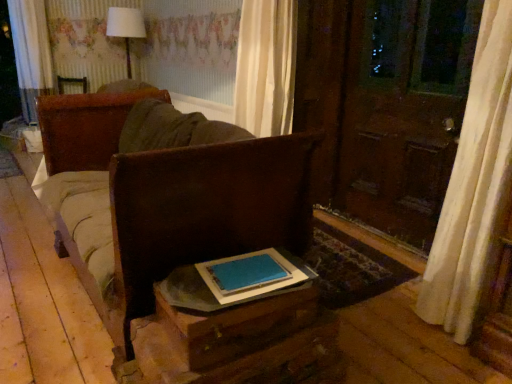
In order to face white fabric lampshade at upper center, should I rotate leftwards or rightwards?

Rotate your view left by about 16.897°.

This screenshot has width=512, height=384. I want to click on white fabric lampshade at upper center, so click(126, 28).

This screenshot has height=384, width=512. What are the coordinates of `wooden table at lower center` in the screenshot? It's located at (233, 315).

Considering the positions of points (264, 204) and (130, 56), is point (264, 204) farther from camera compared to point (130, 56)?

No, it is in front of (130, 56).

Considering the positions of objects brown leather couch at center and white fabric lampshade at upper center in the image provided, who is behind, brown leather couch at center or white fabric lampshade at upper center?

white fabric lampshade at upper center is behind.

From a real-world perspective, does blue matte book at center stand above brown leather couch at center?

Yes, from a real-world perspective, blue matte book at center is over brown leather couch at center

This screenshot has height=384, width=512. Identify the location of book that is on the right side of brown leather couch at center. (251, 275).

Is blue matte book at center thinner than brown leather couch at center?

Indeed, blue matte book at center has a lesser width compared to brown leather couch at center.

From the image's perspective, is white fabric lampshade at upper center located above or below blue matte book at center?

Clearly, from the image's perspective, white fabric lampshade at upper center is above blue matte book at center.

Are white fabric lampshade at upper center and blue matte book at center far apart?

white fabric lampshade at upper center is positioned a significant distance from blue matte book at center.

What's the angular difference between white fabric lampshade at upper center and blue matte book at center's facing directions?

48.7 degrees.

Is point (131, 31) farther from viewer compared to point (238, 301)?

Yes.

Between blue matte book at center and white fabric lampshade at upper center, which one appears on the right side from the viewer's perspective?

Positioned to the right is blue matte book at center.

Considering the sizes of blue matte book at center and white fabric lampshade at upper center in the image, is blue matte book at center bigger or smaller than white fabric lampshade at upper center?

In the image, blue matte book at center appears to be smaller than white fabric lampshade at upper center.

In terms of width, does blue matte book at center look wider or thinner when compared to white fabric lampshade at upper center?

In the image, blue matte book at center appears to be more narrow than white fabric lampshade at upper center.

Between blue matte book at center and white fabric lampshade at upper center, which one has more height?

Standing taller between the two is white fabric lampshade at upper center.

The image size is (512, 384). I want to click on table lamp on the left of wooden table at lower center, so click(x=126, y=28).

Considering the sizes of objects wooden table at lower center and white fabric lampshade at upper center in the image provided, who is taller, wooden table at lower center or white fabric lampshade at upper center?

With more height is white fabric lampshade at upper center.

Is white fabric lampshade at upper center located within wooden table at lower center?

Definitely not — white fabric lampshade at upper center is not inside wooden table at lower center.

Would you say white fabric lampshade at upper center is outside brown leather couch at center?

white fabric lampshade at upper center is positioned outside brown leather couch at center.

Considering the relative sizes of white fabric lampshade at upper center and brown leather couch at center in the image provided, is white fabric lampshade at upper center shorter than brown leather couch at center?

Indeed, white fabric lampshade at upper center has a lesser height compared to brown leather couch at center.

Find the location of a particular element. The width and height of the screenshot is (512, 384). table lamp on the left of brown leather couch at center is located at coordinates (126, 28).

Does point (121, 12) come behind point (133, 200)?

Yes, it is.

Can you confirm if wooden table at lower center is shorter than brown leather couch at center?

Yes, wooden table at lower center is shorter than brown leather couch at center.

Can you confirm if wooden table at lower center is bigger than brown leather couch at center?

No.

From a real-world perspective, is wooden table at lower center on brown leather couch at center?

No, from a real-world perspective, wooden table at lower center is not on top of brown leather couch at center.

The image size is (512, 384). Find the location of `furniture below the white fabric lampshade at upper center (from a real-world perspective)`. furniture below the white fabric lampshade at upper center (from a real-world perspective) is located at coordinates (172, 199).

Where is `book above the brown leather couch at center (from a real-world perspective)`? book above the brown leather couch at center (from a real-world perspective) is located at coordinates (251, 275).

From the image, which object appears to be farther from brown leather couch at center, white fabric lampshade at upper center or blue matte book at center?

Among the two, white fabric lampshade at upper center is located further to brown leather couch at center.

From the picture: When comparing their distances from wooden table at lower center, does blue matte book at center or white fabric lampshade at upper center seem further?

white fabric lampshade at upper center.

From the image, which object appears to be nearer to blue matte book at center, brown leather couch at center or white fabric lampshade at upper center?

brown leather couch at center is closer to blue matte book at center.

Considering their positions, is brown leather couch at center positioned further to wooden table at lower center than white fabric lampshade at upper center?

white fabric lampshade at upper center lies further to wooden table at lower center than the other object.

Which object lies nearer to the anchor point white fabric lampshade at upper center, blue matte book at center or wooden table at lower center?

blue matte book at center.

Considering their positions, is blue matte book at center positioned further to brown leather couch at center than wooden table at lower center?

blue matte book at center.

From the image, which object appears to be farther from white fabric lampshade at upper center, wooden table at lower center or brown leather couch at center?

The object further to white fabric lampshade at upper center is wooden table at lower center.

Looking at the image, which one is located closer to wooden table at lower center, brown leather couch at center or blue matte book at center?

blue matte book at center lies closer to wooden table at lower center than the other object.

At what (x,y) coordinates should I click in order to perform the action: click on furniture located between wooden table at lower center and white fabric lampshade at upper center in the depth direction. Please return your answer as a coordinate pair (x, y). This screenshot has width=512, height=384. Looking at the image, I should click on (172, 199).

This screenshot has width=512, height=384. I want to click on book between wooden table at lower center and white fabric lampshade at upper center in the front-back direction, so click(251, 275).

The width and height of the screenshot is (512, 384). Find the location of `table situated between brown leather couch at center and blue matte book at center from left to right`. table situated between brown leather couch at center and blue matte book at center from left to right is located at coordinates (233, 315).

Where is `book between brown leather couch at center and white fabric lampshade at upper center along the z-axis`? The image size is (512, 384). book between brown leather couch at center and white fabric lampshade at upper center along the z-axis is located at coordinates (251, 275).